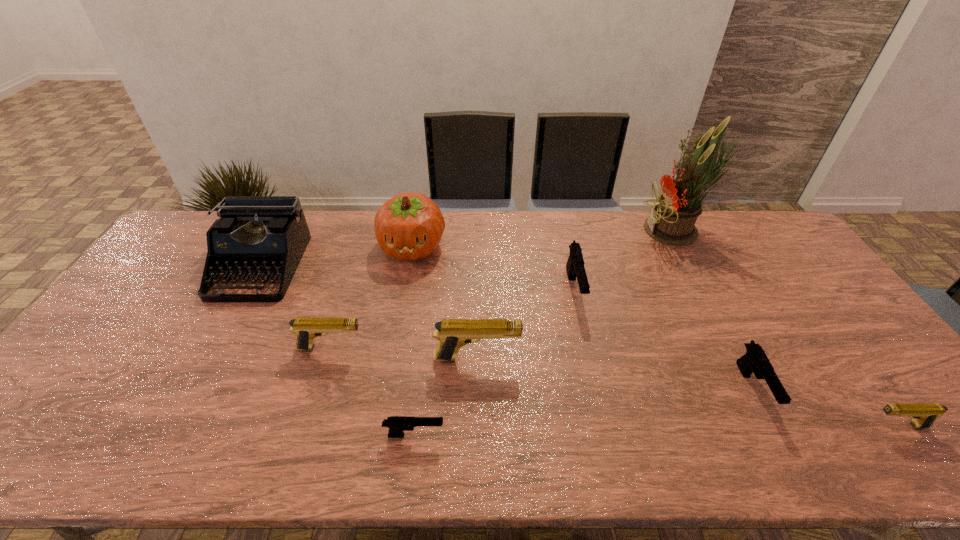
Where is `free spot located on the side of the pumpkin with the cute face`? This screenshot has width=960, height=540. free spot located on the side of the pumpkin with the cute face is located at coordinates (397, 332).

In order to click on free space located 0.220m on the typing side of the leftmost object in this screenshot , I will do `click(204, 364)`.

Identify the location of free space located 0.160m at the barrel of the biggest tan pistol. pyautogui.click(x=581, y=359).

The height and width of the screenshot is (540, 960). In order to click on vacant space located on the front-facing side of the second black pistol from left to right in this screenshot , I will do `click(586, 342)`.

Image resolution: width=960 pixels, height=540 pixels. Identify the location of vacant area situated at the barrel of the leftmost pistol. (397, 348).

Locate an element on the screen. The height and width of the screenshot is (540, 960). free region located at the barrel of the nearest tan pistol is located at coordinates (798, 427).

The image size is (960, 540). In order to click on free space located 0.250m at the barrel of the nearest tan pistol in this screenshot , I will do `click(759, 427)`.

Where is `free space located 0.180m at the barrel of the nearest tan pistol`? Image resolution: width=960 pixels, height=540 pixels. free space located 0.180m at the barrel of the nearest tan pistol is located at coordinates (789, 427).

This screenshot has width=960, height=540. Identify the location of vacant region located 0.380m on the front-facing side of the nearest object. (612, 435).

Identify the location of flower arrangement located at the far edge. This screenshot has width=960, height=540. (671, 221).